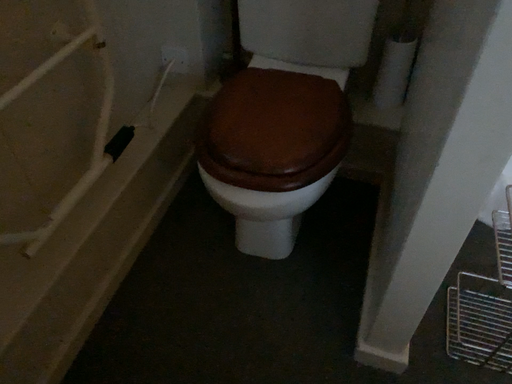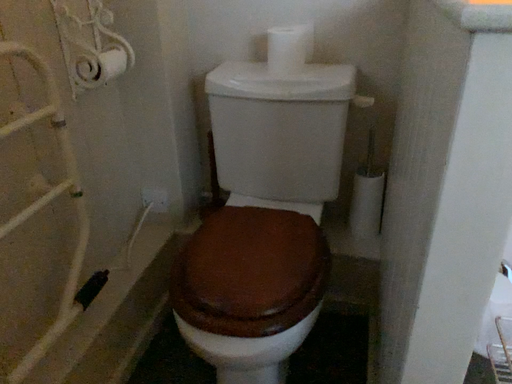
Question: How did the camera likely rotate when shooting the video?

Choices:
 (A) rotated upward
 (B) rotated downward

Answer: (A)